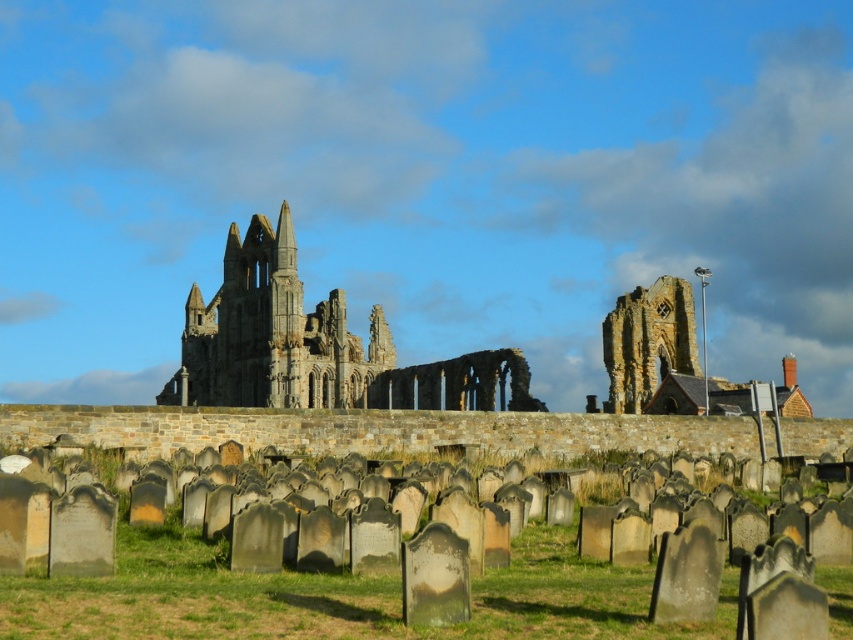
You are standing in the cemetery at the ruins of Whitby Abbey and want to take a photo of both point (19, 609) and point (465, 356). Which point should you focus on first to ensure both are in clear view?

You should focus on point (19, 609) first because it is closer to the camera than point (465, 356), ensuring both points are in focus.

You are standing at the entrance of the cemetery and want to walk towards the stone gothic ruins at center. Which direction should you walk to avoid stepping on the green grass at lower center?

To avoid stepping on the green grass at lower center, you should walk around it since the stone gothic ruins at center are further away and the green grass at lower center is closer to you. Alternatively, you could walk behind the green grass at lower center towards the ruins.